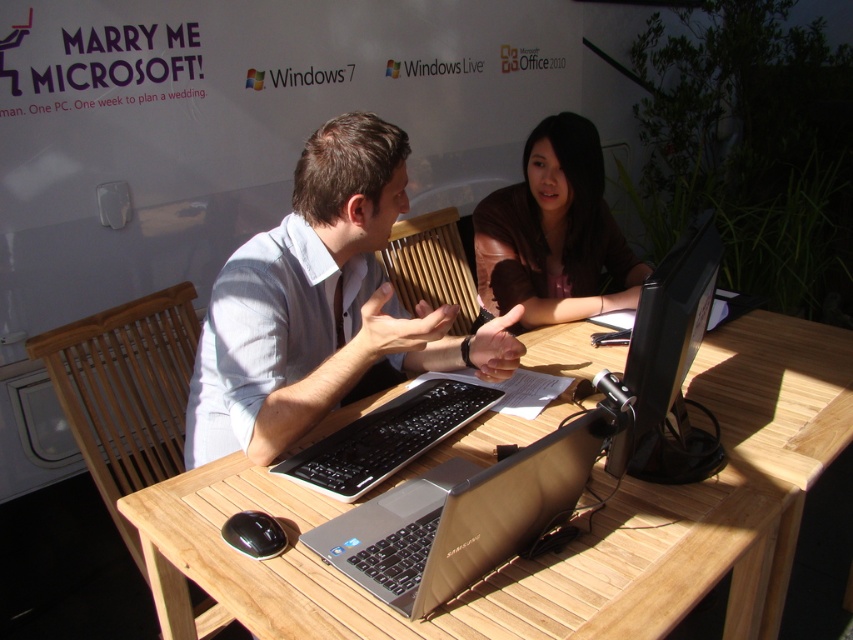
Can you confirm if silver metallic laptop at center is positioned above brown leather jacket at upper center?

No, silver metallic laptop at center is not above brown leather jacket at upper center.

Is silver metallic laptop at center positioned in front of brown leather jacket at upper center?

Yes.

Between point (426, 529) and point (543, 163), which one is positioned in front?

Positioned in front is point (426, 529).

Where is `silver metallic laptop at center`? This screenshot has height=640, width=853. silver metallic laptop at center is located at coordinates (462, 516).

Which of these two, light blue shirt at center or brown leather jacket at upper center, stands shorter?

brown leather jacket at upper center

Does light blue shirt at center appear over brown leather jacket at upper center?

No.

Is point (329, 378) more distant than point (485, 225)?

No, it is in front of (485, 225).

The image size is (853, 640). What are the coordinates of `light blue shirt at center` in the screenshot? It's located at (320, 305).

From the picture: Between silver metallic laptop at center and black glossy monitor at center, which one is positioned higher?

black glossy monitor at center is higher up.

Can you confirm if silver metallic laptop at center is positioned below black glossy monitor at center?

Indeed, silver metallic laptop at center is positioned under black glossy monitor at center.

Between point (421, 513) and point (708, 241), which one is positioned behind?

Point (708, 241)

What are the coordinates of `silver metallic laptop at center` in the screenshot? It's located at (462, 516).